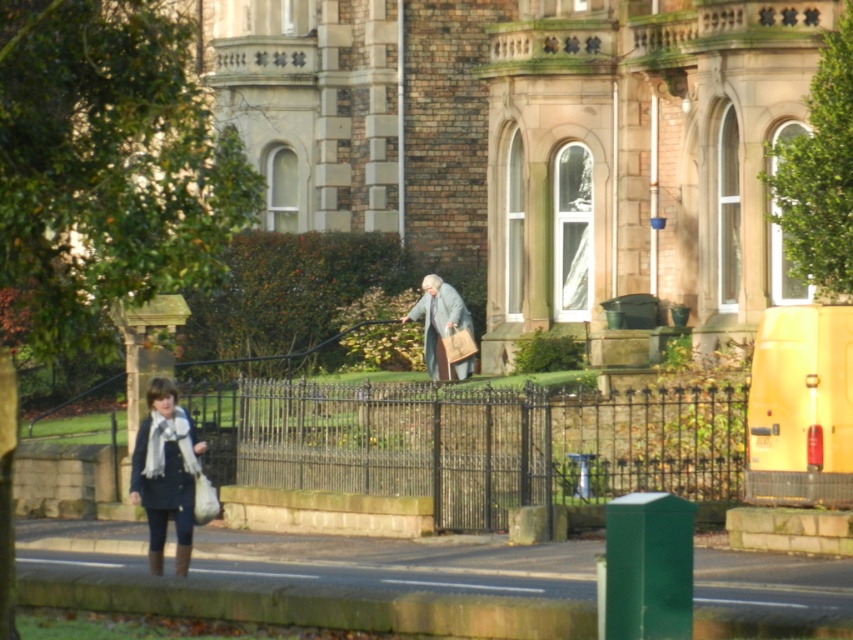
You are a delivery person trying to park your 1.2 meter wide cart near the green stone pavement at lower center. The light gray woolen robe at center is currently occupying part of the pavement. Can your cart fit on the remaining space if the robe moves aside?

The green stone pavement at lower center is wider than the light gray woolen robe at center, so if the robe moves aside, there should be enough space for the 1.2 meter wide cart to fit on the remaining part of the pavement.